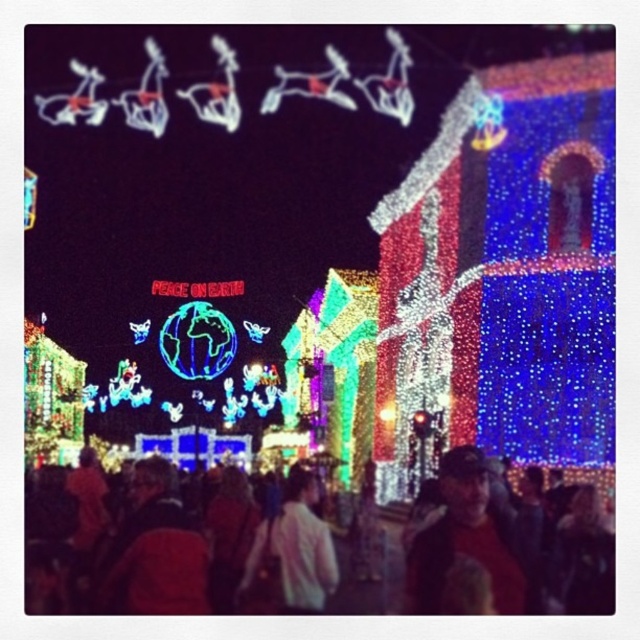
You are a photographer trying to capture a clear shot of the dark hair at lower right without the multicolored fabric crowd at center blocking it. What should you do?

The multicolored fabric crowd at center is in front of the dark hair at lower right, so you should move your position to avoid the crowd blocking the view of the dark hair at lower right.